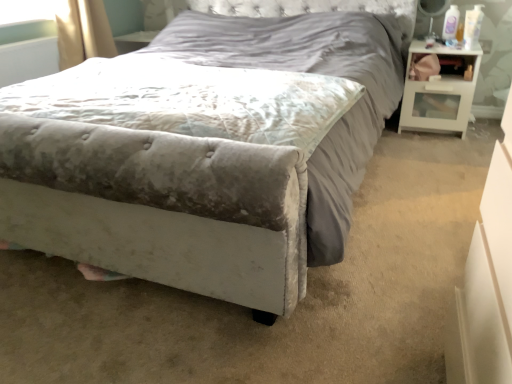
Question: Are velvet gray mattress at center and velvet gray bed at center far apart?

Choices:
 (A) no
 (B) yes

Answer: (A)

Question: Is velvet gray mattress at center wider than velvet gray bed at center?

Choices:
 (A) yes
 (B) no

Answer: (B)

Question: Would you say velvet gray mattress at center contains velvet gray bed at center?

Choices:
 (A) no
 (B) yes

Answer: (A)

Question: Is velvet gray mattress at center positioned before velvet gray bed at center?

Choices:
 (A) yes
 (B) no

Answer: (B)

Question: From a real-world perspective, is velvet gray mattress at center on top of velvet gray bed at center?

Choices:
 (A) no
 (B) yes

Answer: (B)

Question: Considering the positions of point (414, 66) and point (320, 77), is point (414, 66) closer or farther from the camera than point (320, 77)?

Choices:
 (A) farther
 (B) closer

Answer: (A)

Question: In terms of width, does white glossy nightstand at right look wider or thinner when compared to velvet gray mattress at center?

Choices:
 (A) wide
 (B) thin

Answer: (B)

Question: Based on their positions, is white glossy nightstand at right located to the left or right of velvet gray mattress at center?

Choices:
 (A) right
 (B) left

Answer: (A)

Question: From the image's perspective, relative to velvet gray mattress at center, is white glossy nightstand at right above or below?

Choices:
 (A) above
 (B) below

Answer: (A)

Question: Do you think white glossy nightstand at right is within velvet gray bed at center, or outside of it?

Choices:
 (A) outside
 (B) inside

Answer: (A)

Question: From a real-world perspective, relative to velvet gray bed at center, is white glossy nightstand at right vertically above or below?

Choices:
 (A) below
 (B) above

Answer: (A)

Question: In terms of height, does white glossy nightstand at right look taller or shorter compared to velvet gray bed at center?

Choices:
 (A) short
 (B) tall

Answer: (A)

Question: Is point (413, 86) closer or farther from the camera than point (242, 145)?

Choices:
 (A) closer
 (B) farther

Answer: (B)

Question: Would you say velvet gray mattress at center is to the left or to the right of white glossy nightstand at right in the picture?

Choices:
 (A) left
 (B) right

Answer: (A)

Question: From their relative heights in the image, would you say velvet gray mattress at center is taller or shorter than white glossy nightstand at right?

Choices:
 (A) tall
 (B) short

Answer: (B)